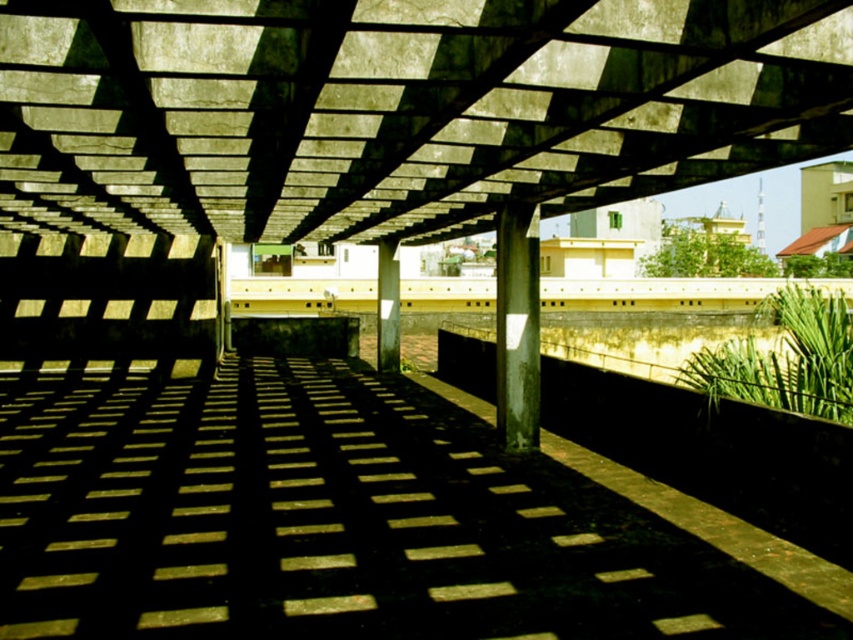
You are standing at the entrance of the walkway and want to reach the smooth concrete path at center without touching the metallic gray column at center. Is this possible?

The smooth concrete path at center is located below the metallic gray column at center, so you can reach the smooth concrete path at center by going under the metallic gray column at center without touching it.

Looking at this image, you are standing at the entrance of the walkway and want to step onto the concrete at center and the smooth concrete path at center. Which surface will you step on first?

You will step on the concrete at center first because it is closer to you than the smooth concrete path at center.

You are standing at the entrance of the walkway and want to reach the smooth concrete path at center. According to the coordinates provided, in which direction should you move from your current position to reach it?

The smooth concrete path at center is located at coordinates point [352,522]. Since you are at the entrance, which is likely at the start of the walkway, moving forward along the walkway towards the center would lead you to the smooth concrete path at center.